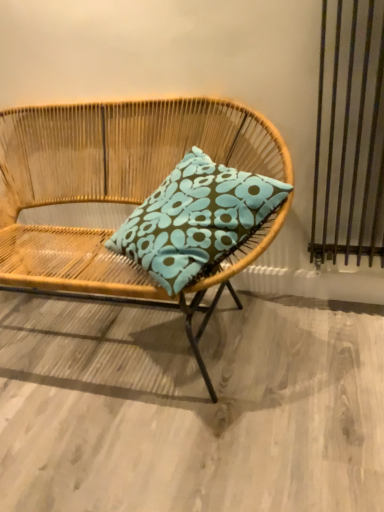
Question: Relative to teal fabric pillow at center, is woven wood chair at center in front or behind?

Choices:
 (A) behind
 (B) front

Answer: (B)

Question: Does point (124, 160) appear closer or farther from the camera than point (172, 200)?

Choices:
 (A) closer
 (B) farther

Answer: (B)

Question: Is woven wood chair at center wider or thinner than teal fabric pillow at center?

Choices:
 (A) thin
 (B) wide

Answer: (B)

Question: Looking at the image, does teal fabric pillow at center seem bigger or smaller compared to woven wood chair at center?

Choices:
 (A) big
 (B) small

Answer: (B)

Question: Is teal fabric pillow at center wider or thinner than woven wood chair at center?

Choices:
 (A) wide
 (B) thin

Answer: (B)

Question: In the image, is teal fabric pillow at center positioned in front of or behind woven wood chair at center?

Choices:
 (A) front
 (B) behind

Answer: (B)

Question: Does point (122, 237) appear closer or farther from the camera than point (13, 194)?

Choices:
 (A) closer
 (B) farther

Answer: (A)